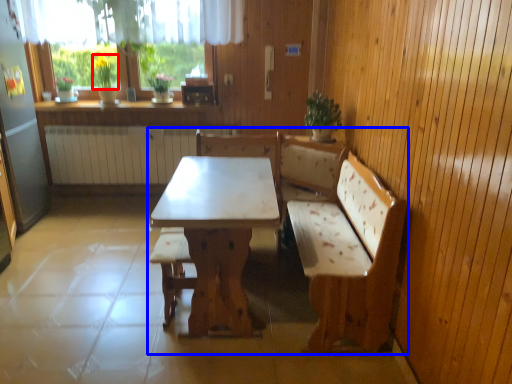
Question: Which point is further to the camera, plant (highlighted by a red box) or furniture (highlighted by a blue box)?

Choices:
 (A) plant
 (B) furniture

Answer: (A)